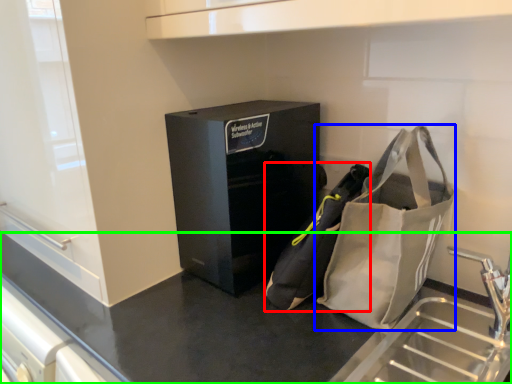
Question: Which object is the closest to the pouch (highlighted by a red box)? Choose among these: handbag (highlighted by a blue box) or counter (highlighted by a green box).

Choices:
 (A) handbag
 (B) counter

Answer: (A)